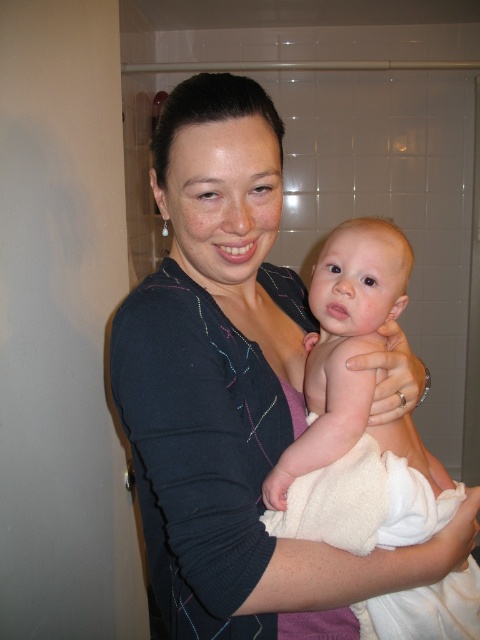
Question: Does matte black sweater at center lie in front of white towel wrapped baby at center?

Choices:
 (A) no
 (B) yes

Answer: (B)

Question: Which object is farther from the camera taking this photo?

Choices:
 (A) white towel wrapped baby at center
 (B) matte black sweater at center

Answer: (A)

Question: Is matte black sweater at center closer to camera compared to white towel wrapped baby at center?

Choices:
 (A) no
 (B) yes

Answer: (B)

Question: Which point appears closest to the camera in this image?

Choices:
 (A) (276, 483)
 (B) (260, 154)

Answer: (B)

Question: Is matte black sweater at center bigger than white towel wrapped baby at center?

Choices:
 (A) yes
 (B) no

Answer: (A)

Question: Among these objects, which one is farthest from the camera?

Choices:
 (A) white towel wrapped baby at center
 (B) matte black sweater at center

Answer: (A)